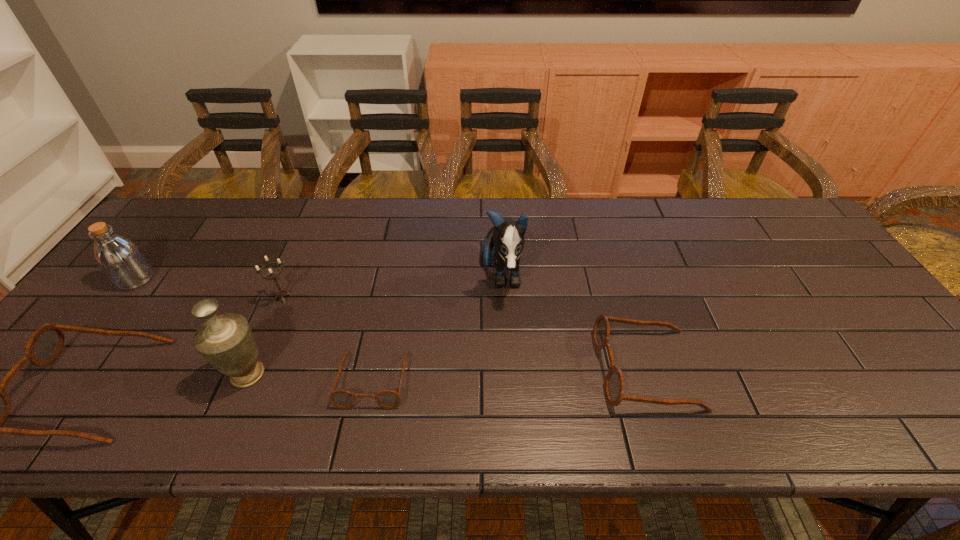
Locate which spectacles ranks in proximity to the sixth shortest object. Please provide its 2D coordinates. Your answer should be formatted as a tuple, i.e. [(x, y)], where the tuple contains the x and y coordinates of a point satisfying the conditions above.

[(45, 344)]

This screenshot has height=540, width=960. Identify the location of the second closest spectacles to the leftmost spectacles. (614, 386).